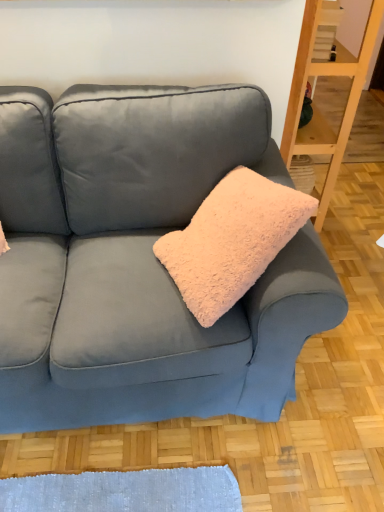
Question: Is velvet blue couch at center oriented towards fuzzy pink pillow at center?

Choices:
 (A) yes
 (B) no

Answer: (A)

Question: Is fuzzy pink pillow at center surrounded by velvet blue couch at center?

Choices:
 (A) no
 (B) yes

Answer: (B)

Question: Is velvet blue couch at center to the right of fuzzy pink pillow at center from the viewer's perspective?

Choices:
 (A) yes
 (B) no

Answer: (B)

Question: Is velvet blue couch at center turned away from fuzzy pink pillow at center?

Choices:
 (A) no
 (B) yes

Answer: (B)

Question: Can you confirm if velvet blue couch at center is positioned to the left of fuzzy pink pillow at center?

Choices:
 (A) no
 (B) yes

Answer: (B)

Question: From a real-world perspective, is velvet blue couch at center located higher than fuzzy pink pillow at center?

Choices:
 (A) no
 (B) yes

Answer: (A)

Question: Considering the relative sizes of wooden shelf at right and fuzzy pink pillow at center in the image provided, is wooden shelf at right taller than fuzzy pink pillow at center?

Choices:
 (A) no
 (B) yes

Answer: (B)

Question: From the image's perspective, does wooden shelf at right appear higher than fuzzy pink pillow at center?

Choices:
 (A) no
 (B) yes

Answer: (B)

Question: Does wooden shelf at right have a smaller size compared to fuzzy pink pillow at center?

Choices:
 (A) no
 (B) yes

Answer: (B)

Question: Is wooden shelf at right positioned in front of fuzzy pink pillow at center?

Choices:
 (A) yes
 (B) no

Answer: (B)

Question: From a real-world perspective, does wooden shelf at right stand above fuzzy pink pillow at center?

Choices:
 (A) yes
 (B) no

Answer: (B)

Question: Considering the relative positions of wooden shelf at right and fuzzy pink pillow at center in the image provided, is wooden shelf at right to the left of fuzzy pink pillow at center from the viewer's perspective?

Choices:
 (A) no
 (B) yes

Answer: (A)

Question: Considering the relative positions of wooden shelf at right and velvet blue couch at center in the image provided, is wooden shelf at right to the right of velvet blue couch at center from the viewer's perspective?

Choices:
 (A) no
 (B) yes

Answer: (B)